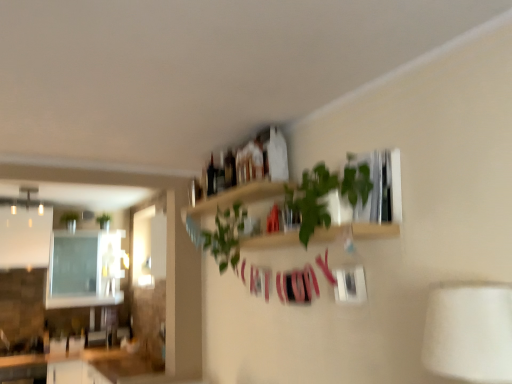
Question: From a real-world perspective, does white fabric lampshade at lower right stand above green matte plant at upper left, the second plant in the right-to-left sequence?

Choices:
 (A) yes
 (B) no

Answer: (B)

Question: Is white fabric lampshade at lower right positioned beyond the bounds of green matte plant at upper left, which appears as the 1th plant when viewed from the left?

Choices:
 (A) no
 (B) yes

Answer: (B)

Question: Considering the relative sizes of white fabric lampshade at lower right and green matte plant at upper left, which appears as the 1th plant when viewed from the left, in the image provided, is white fabric lampshade at lower right bigger than green matte plant at upper left, which appears as the 1th plant when viewed from the left,?

Choices:
 (A) yes
 (B) no

Answer: (A)

Question: From the image's perspective, would you say white fabric lampshade at lower right is positioned over green matte plant at upper left, which appears as the 1th plant when viewed from the left?

Choices:
 (A) yes
 (B) no

Answer: (B)

Question: From a real-world perspective, is white fabric lampshade at lower right under green matte plant at upper left, which appears as the 1th plant when viewed from the back?

Choices:
 (A) no
 (B) yes

Answer: (B)

Question: Would you say green leafy plant at upper center is inside or outside green leafy plant at upper center, the 2th shelf in the top-to-bottom sequence?

Choices:
 (A) outside
 (B) inside

Answer: (A)

Question: From a real-world perspective, is green leafy plant at upper center positioned above or below green leafy plant at upper center, marked as the first shelf in a bottom-to-top arrangement?

Choices:
 (A) above
 (B) below

Answer: (A)

Question: In the image, is green leafy plant at upper center on the left side or the right side of green leafy plant at upper center, the 2th shelf in the top-to-bottom sequence?

Choices:
 (A) left
 (B) right

Answer: (B)

Question: Considering their positions, is green leafy plant at upper center located in front of or behind green leafy plant at upper center, the 2th shelf in the top-to-bottom sequence?

Choices:
 (A) behind
 (B) front

Answer: (B)

Question: From a real-world perspective, relative to green leafy plant at upper center, which ranks as the 1th plant in front-to-back order, is wooden shelf at upper center, arranged as the first shelf when viewed from the top, vertically above or below?

Choices:
 (A) above
 (B) below

Answer: (A)

Question: In terms of size, does wooden shelf at upper center, arranged as the first shelf when viewed from the top, appear bigger or smaller than green leafy plant at upper center, which ranks as the 1th plant in front-to-back order?

Choices:
 (A) big
 (B) small

Answer: (B)

Question: Is wooden shelf at upper center, arranged as the first shelf when viewed from the top, spatially inside green leafy plant at upper center, which ranks as the 1th plant in front-to-back order, or outside of it?

Choices:
 (A) outside
 (B) inside

Answer: (A)

Question: In terms of height, does wooden shelf at upper center, arranged as the first shelf when viewed from the top, look taller or shorter compared to green leafy plant at upper center, the second plant from the left?

Choices:
 (A) short
 (B) tall

Answer: (A)

Question: Relative to green matte plant at upper left, which appears as the 1th plant when viewed from the left, is green leafy plant at upper center, which ranks as the 1th plant in front-to-back order, in front or behind?

Choices:
 (A) front
 (B) behind

Answer: (A)

Question: Considering the positions of green leafy plant at upper center, the second plant from the left, and green matte plant at upper left, the second plant in the right-to-left sequence, in the image, is green leafy plant at upper center, the second plant from the left, bigger or smaller than green matte plant at upper left, the second plant in the right-to-left sequence,?

Choices:
 (A) small
 (B) big

Answer: (B)